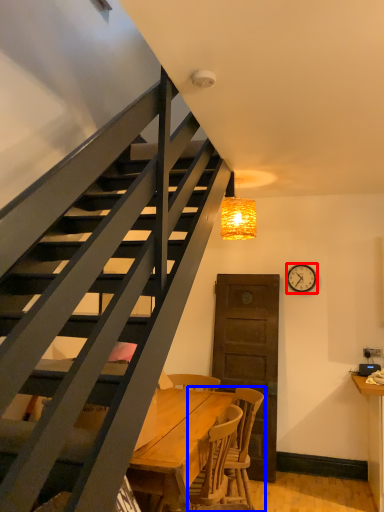
Question: Among these objects, which one is farthest to the camera, clock (highlighted by a red box) or chair (highlighted by a blue box)?

Choices:
 (A) clock
 (B) chair

Answer: (A)